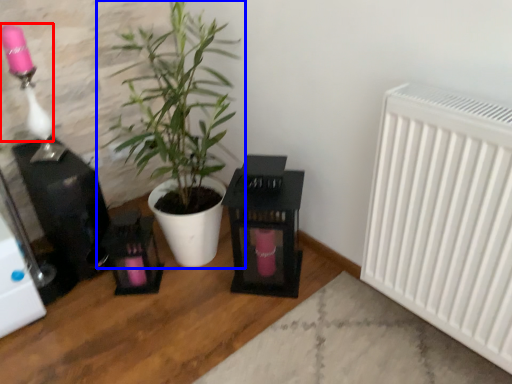
Question: Which object appears farthest to the camera in this image, lamp (highlighted by a red box) or houseplant (highlighted by a blue box)?

Choices:
 (A) lamp
 (B) houseplant

Answer: (A)